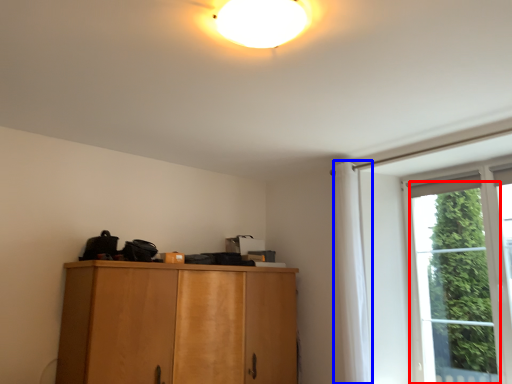
Question: Which object appears farthest to the camera in this image, window (highlighted by a red box) or curtain (highlighted by a blue box)?

Choices:
 (A) window
 (B) curtain

Answer: (B)